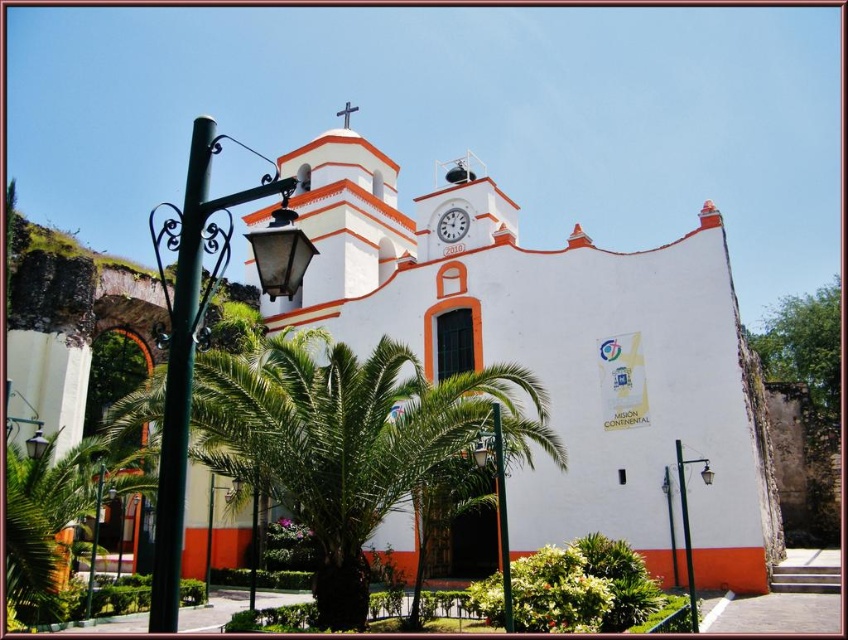
Which is in front, point (436, 292) or point (503, 468)?

Point (503, 468) is more forward.

Does white stucco chapel at center have a greater width compared to green metallic pole at center?

Indeed, white stucco chapel at center has a greater width compared to green metallic pole at center.

The image size is (848, 640). In order to click on white stucco chapel at center in this screenshot , I will do `click(556, 352)`.

Is green wrought iron streetlight at left positioned before green metallic pole at center?

Yes, green wrought iron streetlight at left is closer to the viewer.

Consider the image. Which is below, green wrought iron streetlight at left or green metallic pole at center?

green metallic pole at center is below.

Which is behind, point (283, 250) or point (500, 433)?

Positioned behind is point (500, 433).

Identify the location of green wrought iron streetlight at left. (205, 326).

Can you confirm if green metallic pole at center is positioned to the right of orange matte spire at upper center?

Indeed, green metallic pole at center is positioned on the right side of orange matte spire at upper center.

Is green metallic pole at center bigger than orange matte spire at upper center?

Yes, green metallic pole at center is bigger than orange matte spire at upper center.

Is point (503, 532) closer to viewer compared to point (349, 116)?

Yes, it is.

I want to click on green metallic pole at center, so click(x=501, y=516).